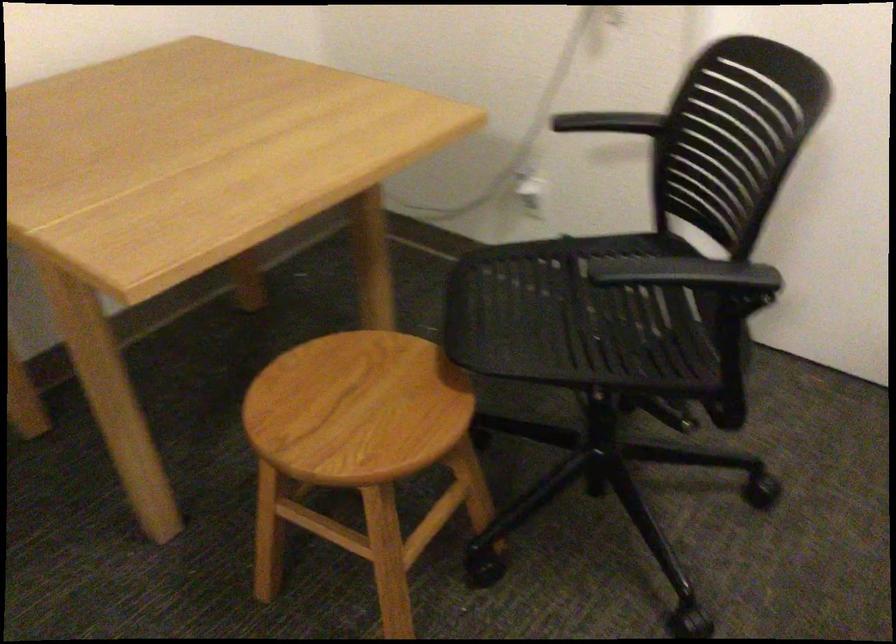
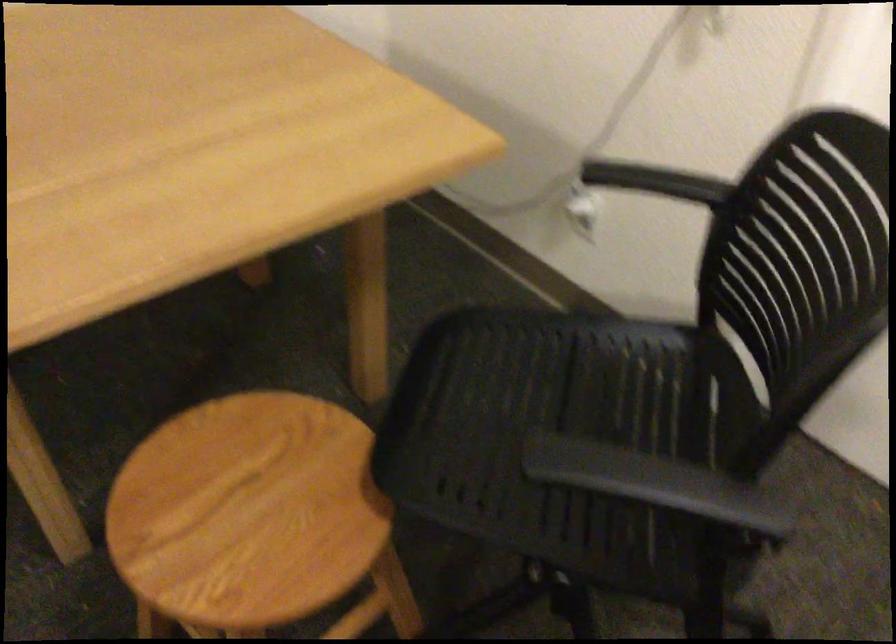
The images are taken continuously from a first-person perspective. In which direction are you moving?

The cameraman moved toward right, forward.